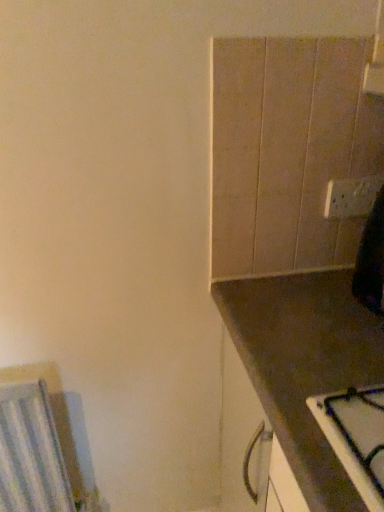
Where is `brown matte countertop at right`? This screenshot has width=384, height=512. brown matte countertop at right is located at coordinates (276, 317).

Image resolution: width=384 pixels, height=512 pixels. What do you see at coordinates (276, 317) in the screenshot? I see `brown matte countertop at right` at bounding box center [276, 317].

From the picture: Measure the distance between white glossy electric outlet at upper right and camera.

The distance of white glossy electric outlet at upper right from camera is 36.42 inches.

In order to click on white glossy electric outlet at upper right in this screenshot , I will do `click(351, 197)`.

The image size is (384, 512). What do you see at coordinates (351, 197) in the screenshot?
I see `white glossy electric outlet at upper right` at bounding box center [351, 197].

This screenshot has width=384, height=512. Find the location of `brown matte countertop at right`. brown matte countertop at right is located at coordinates (276, 317).

Which object is positioned more to the right, white glossy electric outlet at upper right or brown matte countertop at right?

Positioned to the right is white glossy electric outlet at upper right.

Is white glossy electric outlet at upper right in front of brown matte countertop at right?

That is False.

Between point (332, 209) and point (263, 303), which one is positioned in front?

The point (263, 303) is more forward.

From the image's perspective, does white glossy electric outlet at upper right appear higher than brown matte countertop at right?

Correct, white glossy electric outlet at upper right appears higher than brown matte countertop at right in the image.

From a real-world perspective, is white glossy electric outlet at upper right below brown matte countertop at right?

No, from a real-world perspective, white glossy electric outlet at upper right is not below brown matte countertop at right.

In terms of width, does white glossy electric outlet at upper right look wider or thinner when compared to brown matte countertop at right?

white glossy electric outlet at upper right is thinner than brown matte countertop at right.

Who is taller, white glossy electric outlet at upper right or brown matte countertop at right?

brown matte countertop at right.

Which of these two, white glossy electric outlet at upper right or brown matte countertop at right, is smaller?

white glossy electric outlet at upper right.

Is white glossy electric outlet at upper right inside the boundaries of brown matte countertop at right, or outside?

white glossy electric outlet at upper right cannot be found inside brown matte countertop at right.

Are white glossy electric outlet at upper right and brown matte countertop at right located far from each other?

No, white glossy electric outlet at upper right is in close proximity to brown matte countertop at right.

Could you tell me if white glossy electric outlet at upper right is facing brown matte countertop at right?

No, white glossy electric outlet at upper right is not oriented towards brown matte countertop at right.

Can you tell me how much white glossy electric outlet at upper right and brown matte countertop at right differ in facing direction?

There is a 90.3-degree angle between the facing directions of white glossy electric outlet at upper right and brown matte countertop at right.

Identify the location of countertop below the white glossy electric outlet at upper right (from the image's perspective). (276, 317).

Is brown matte countertop at right to the left of white glossy electric outlet at upper right from the viewer's perspective?

Yes, brown matte countertop at right is to the left of white glossy electric outlet at upper right.

Is the position of brown matte countertop at right more distant than that of white glossy electric outlet at upper right?

No, brown matte countertop at right is closer to the camera.

Is point (235, 315) closer to camera compared to point (369, 212)?

That is True.

From the image's perspective, is brown matte countertop at right located above white glossy electric outlet at upper right?

No, from the image's perspective, brown matte countertop at right is not above white glossy electric outlet at upper right.

From a real-world perspective, is brown matte countertop at right physically above white glossy electric outlet at upper right?

Actually, brown matte countertop at right is physically below white glossy electric outlet at upper right in the real world.

Considering the relative sizes of brown matte countertop at right and white glossy electric outlet at upper right in the image provided, is brown matte countertop at right thinner than white glossy electric outlet at upper right?

No.

Does brown matte countertop at right have a lesser height compared to white glossy electric outlet at upper right?

No, brown matte countertop at right is not shorter than white glossy electric outlet at upper right.

Looking at the image, does brown matte countertop at right seem bigger or smaller compared to white glossy electric outlet at upper right?

brown matte countertop at right is bigger than white glossy electric outlet at upper right.

Is brown matte countertop at right surrounding white glossy electric outlet at upper right?

That's incorrect, white glossy electric outlet at upper right is not inside brown matte countertop at right.

Is brown matte countertop at right not near white glossy electric outlet at upper right?

They are positioned close to each other.

Does brown matte countertop at right turn towards white glossy electric outlet at upper right?

No.

How different are the orientations of brown matte countertop at right and white glossy electric outlet at upper right in degrees?

There is a 90.3-degree angle between the facing directions of brown matte countertop at right and white glossy electric outlet at upper right.

You are a GUI agent. You are given a task and a screenshot of the screen. Output one action in this format:
    pyautogui.click(x=<x>, y=<y>)
    Task: Click on the countertop that is below the white glossy electric outlet at upper right (from the image's perspective)
    Image resolution: width=384 pixels, height=512 pixels.
    Given the screenshot: What is the action you would take?
    pyautogui.click(x=276, y=317)

Locate an element on the screen. Image resolution: width=384 pixels, height=512 pixels. countertop located on the left of white glossy electric outlet at upper right is located at coordinates (276, 317).

Locate an element on the screen. This screenshot has height=512, width=384. countertop in front of the white glossy electric outlet at upper right is located at coordinates (276, 317).